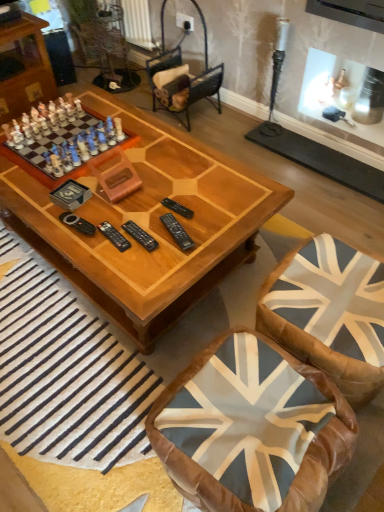
In order to click on vacant area on the back side of black plastic remote at center in this screenshot , I will do `click(139, 206)`.